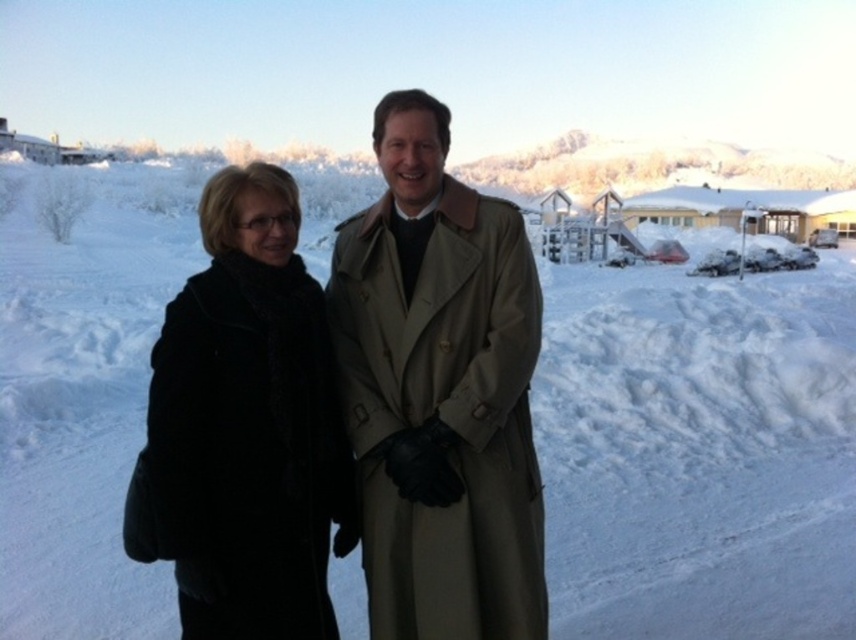
Question: Which is farther from the beige leather trench coat at center?

Choices:
 (A) black wool coat at center
 (B) black wool coat at left

Answer: (B)

Question: Is black wool coat at center to the right of beige leather trench coat at center from the viewer's perspective?

Choices:
 (A) yes
 (B) no

Answer: (A)

Question: Which object is farther from the camera taking this photo?

Choices:
 (A) beige leather trench coat at center
 (B) black wool coat at center

Answer: (B)

Question: Which object is closer to the camera taking this photo?

Choices:
 (A) black wool coat at left
 (B) beige leather trench coat at center
 (C) black wool coat at center

Answer: (A)

Question: Does black wool coat at center appear over beige leather trench coat at center?

Choices:
 (A) yes
 (B) no

Answer: (B)

Question: Can you confirm if black wool coat at center is positioned below beige leather trench coat at center?

Choices:
 (A) no
 (B) yes

Answer: (B)